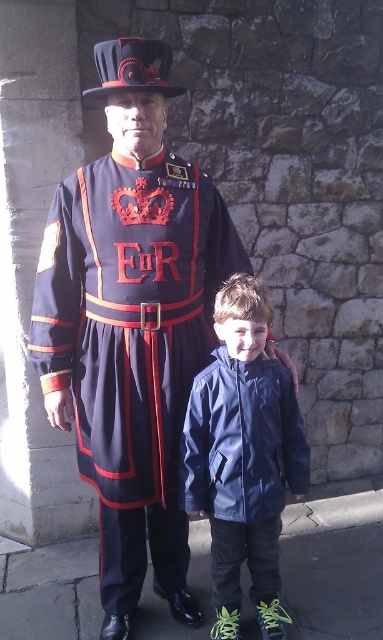
The height and width of the screenshot is (640, 383). What do you see at coordinates (132, 323) in the screenshot?
I see `matte black uniform at center` at bounding box center [132, 323].

Between matte black uniform at center and navy blue jacket at center, which one is positioned lower?

Positioned lower is navy blue jacket at center.

In order to click on matte black uniform at center in this screenshot , I will do `click(132, 323)`.